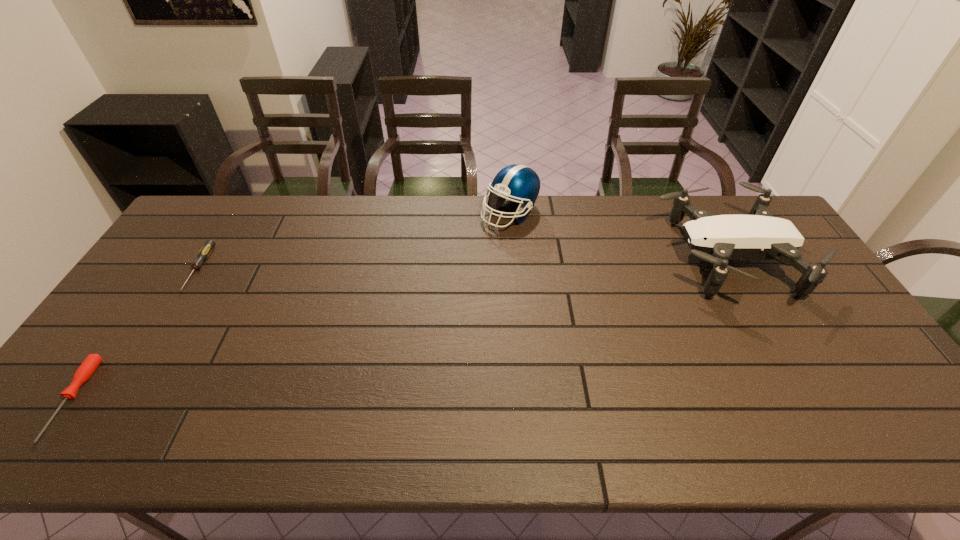
The height and width of the screenshot is (540, 960). Find the location of `the third object from left to right`. the third object from left to right is located at coordinates (519, 183).

Identify the location of the rightmost object. (757, 236).

This screenshot has height=540, width=960. Find the location of `the third shortest object`. the third shortest object is located at coordinates (757, 236).

Where is `the farther screwdriver`? The image size is (960, 540). the farther screwdriver is located at coordinates (203, 254).

Image resolution: width=960 pixels, height=540 pixels. In order to click on the third object from right to left in this screenshot , I will do `click(203, 254)`.

The height and width of the screenshot is (540, 960). I want to click on the nearest object, so click(87, 368).

Identify the location of the leftmost object. The height and width of the screenshot is (540, 960). (87, 368).

Locate an element on the screen. The image size is (960, 540). vacant area located 0.250m at the front of the second object from right to left with the faceguard is located at coordinates pyautogui.click(x=516, y=289).

I want to click on free space located 0.080m on the camera side of the drone, so click(636, 258).

The height and width of the screenshot is (540, 960). Identify the location of vacant area situated 0.100m on the camera side of the drone. (629, 258).